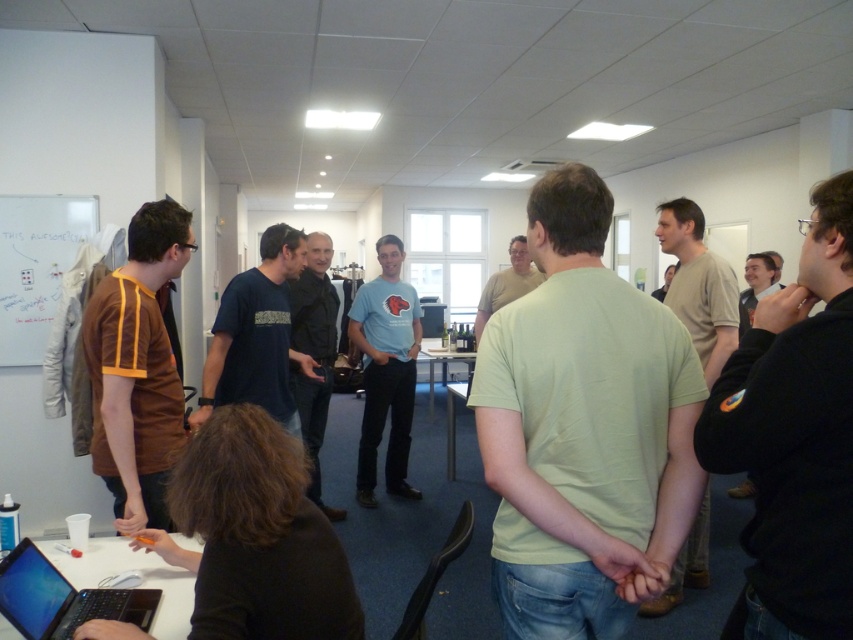
Question: Which of the following is the closest to the observer?

Choices:
 (A) black fabric shirt at right
 (B) light green t-shirt at center

Answer: (A)

Question: Which point is closer to the camera?

Choices:
 (A) white glossy table at center
 (B) light green cotton t-shirt at center
 (C) black fabric jacket at right

Answer: (B)

Question: Is black fabric shirt at right to the left of white glossy table at center from the viewer's perspective?

Choices:
 (A) yes
 (B) no

Answer: (B)

Question: Estimate the real-world distances between objects in this image. Which object is farther from the black fabric jacket at right?

Choices:
 (A) light blue t-shirt at center
 (B) white glossy table at center

Answer: (B)

Question: Does black fabric shirt at right appear over white glossy table at center?

Choices:
 (A) yes
 (B) no

Answer: (A)

Question: Does dark blue t-shirt at center have a smaller size compared to light blue t-shirt at center?

Choices:
 (A) no
 (B) yes

Answer: (B)